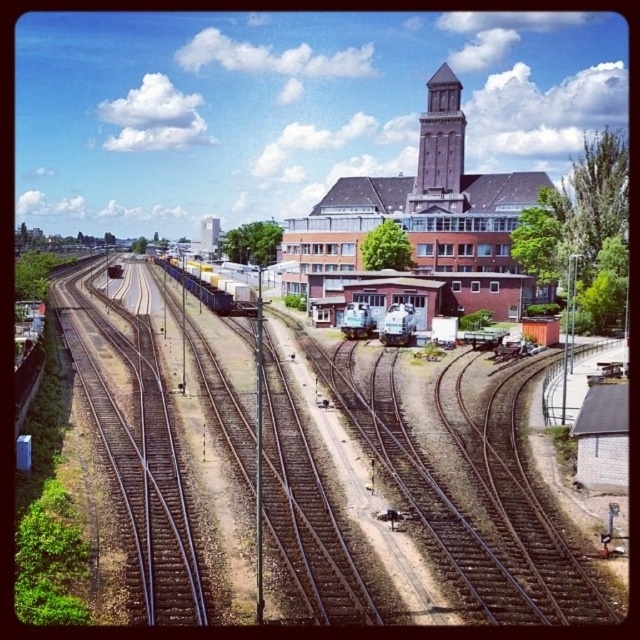
You are a photographer standing in the railway yard and want to capture both the brown brick bell tower at upper center and the brick bell tower at center in your photo. Which tower should you focus on first if you want to include both in your frame without moving the camera?

The brown brick bell tower at upper center is much taller than the brick bell tower at center, so you should focus on the taller one first to ensure it fits in the frame.

You are a passenger waiting at the railway yard and want to board the silver metallic train at center. From your current position at the brown metal tracks at center, which direction should you move to reach the train?

The brown metal tracks at center is located below the silver metallic train at center, so you should move upwards to reach the train.

You are a photographer standing in the railway yard. You want to capture a photo that emphasizes the height of the brown brick bell tower at upper center compared to the yellow matte train carriages at center. Which object should you focus on to achieve this effect?

The brown brick bell tower at upper center is thinner than the yellow matte train carriages at center. To emphasize its height, focus on the brown brick bell tower at upper center as its slenderness will make it appear taller relative to the wider train carriages.